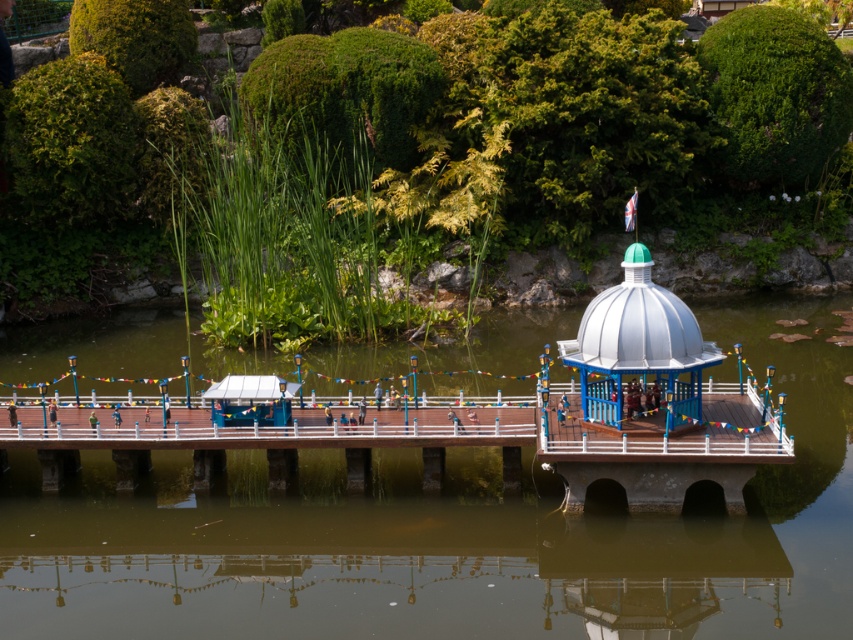
Does white glossy gazebo at upper right lie behind white glossy dome at center?

That is False.

Is point (556, 404) closer to viewer compared to point (602, 333)?

No, (556, 404) is behind (602, 333).

Does point (625, 490) come behind point (639, 358)?

Yes, it is.

Identify the location of white glossy gazebo at upper right. The image size is (853, 640). (653, 403).